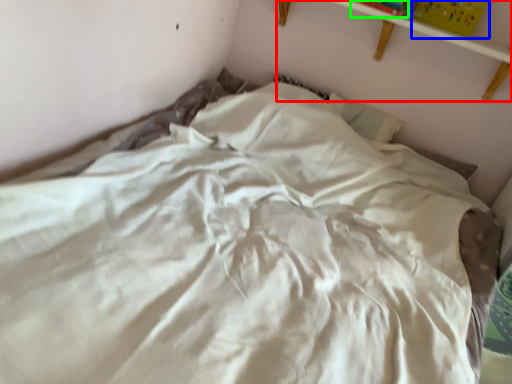
Question: Considering the real-world distances, which object is farthest from shelf (highlighted by a red box)? paperback book (highlighted by a blue box) or paperback book (highlighted by a green box)?

Choices:
 (A) paperback book
 (B) paperback book

Answer: (B)